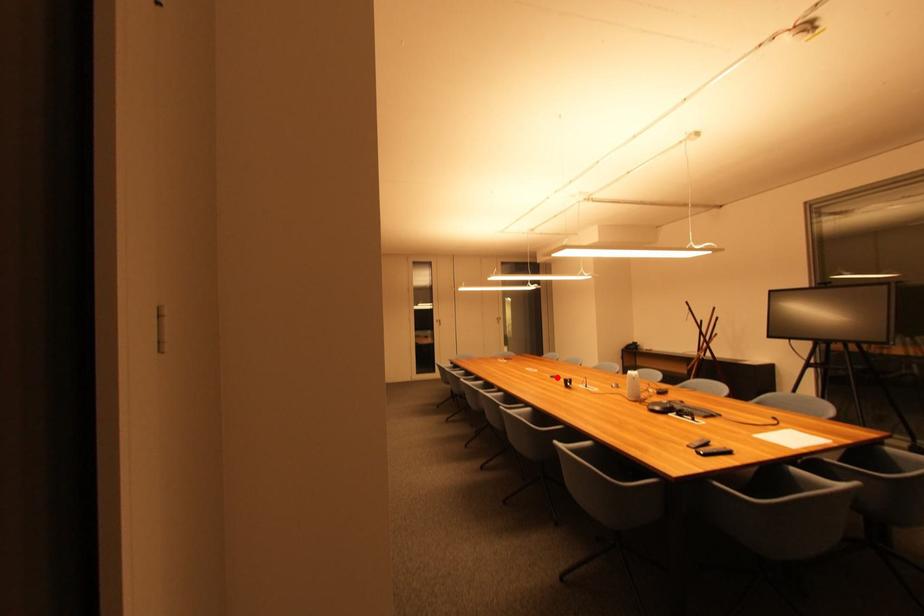
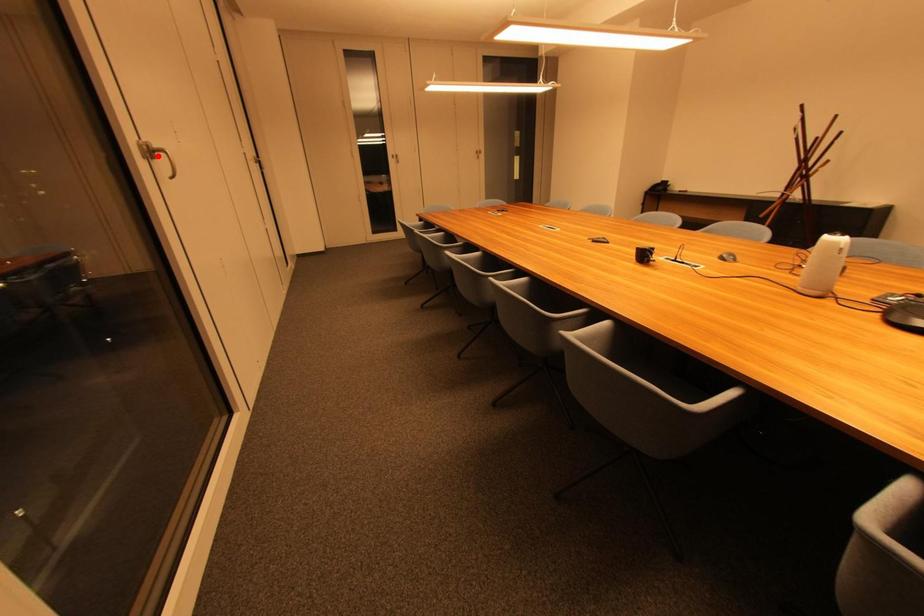
I am providing you with two images of the same scene from different viewpoints. A red point is marked on the first image and another point is marked on the second image. Are the points marked in image1 and image2 representing the same 3D position?

No